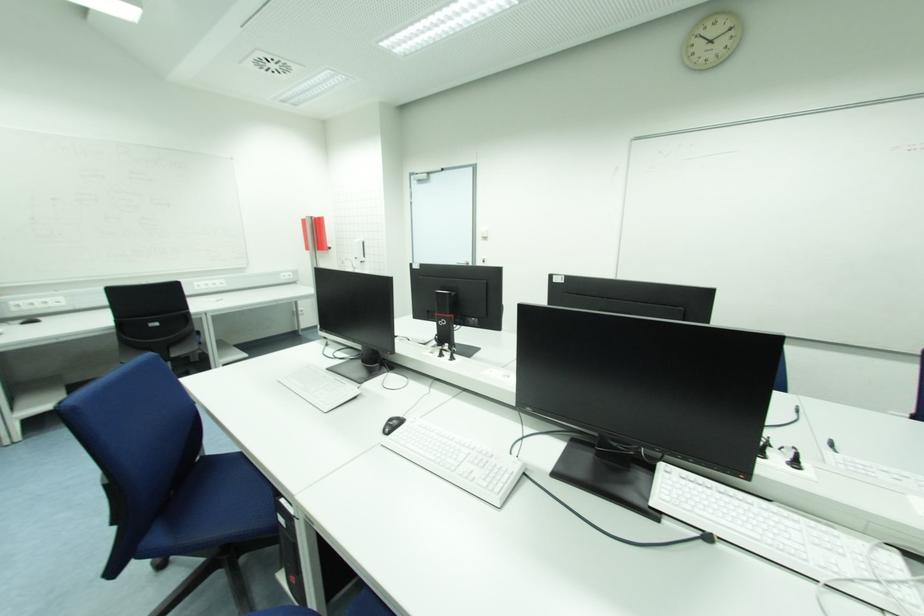
Locate an element on the screen. The width and height of the screenshot is (924, 616). silver door handle is located at coordinates (465, 262).